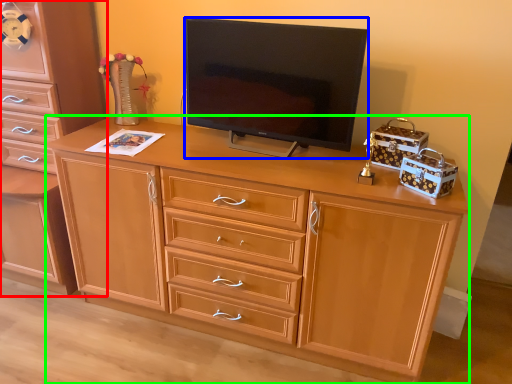
Question: Considering the real-world distances, which object is closest to chest of drawers (highlighted by a red box)? television (highlighted by a blue box) or desk (highlighted by a green box).

Choices:
 (A) television
 (B) desk

Answer: (B)